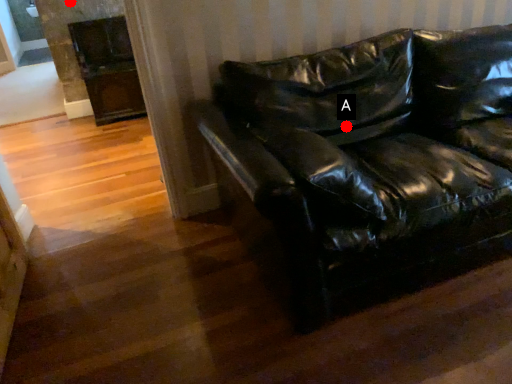
Question: Two points are circled on the image, labeled by A and B beside each circle. Which point is closer to the camera?

Choices:
 (A) A is closer
 (B) B is closer

Answer: (A)